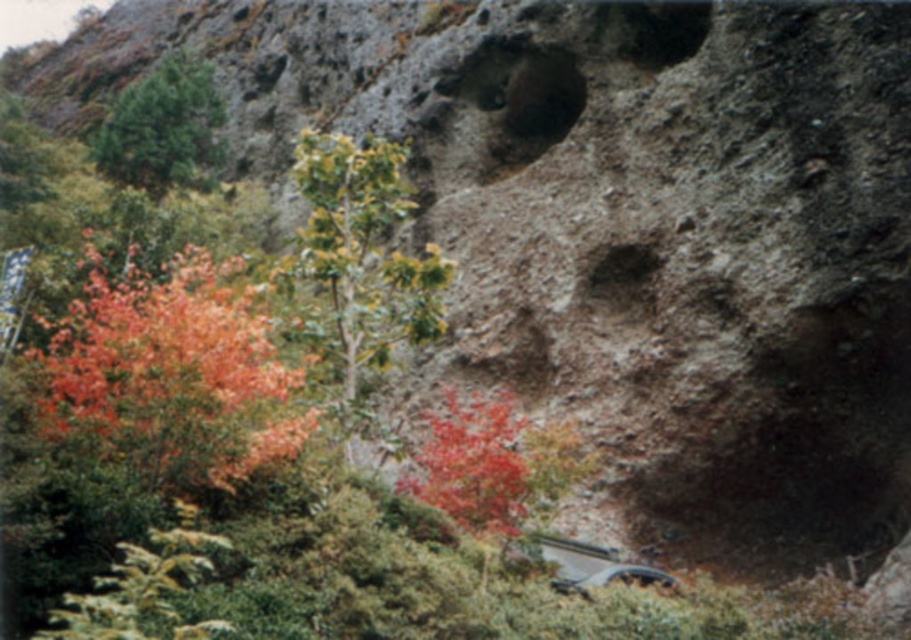
Looking at this image, between green leafy tree at center and vivid red leaves at center, which one has more height?

green leafy tree at center is taller.

Can you confirm if green leafy tree at center is smaller than vivid red leaves at center?

No.

Where is `green leafy tree at center`? Image resolution: width=911 pixels, height=640 pixels. green leafy tree at center is located at coordinates (363, 252).

Is point (364, 323) farther from camera compared to point (203, 156)?

That is False.

Who is more distant from viewer, (350, 388) or (155, 90)?

Point (155, 90)

Locate an element on the screen. The image size is (911, 640). green leafy tree at center is located at coordinates (363, 252).

Is vivid orange leaves at left thinner than green matte tree at upper left?

Correct, vivid orange leaves at left's width is less than green matte tree at upper left's.

Measure the distance from vivid orange leaves at left to green matte tree at upper left.

They are 23.36 meters apart.

Between point (104, 404) and point (169, 100), which one is positioned behind?

Positioned behind is point (169, 100).

Locate an element on the screen. vivid orange leaves at left is located at coordinates (170, 378).